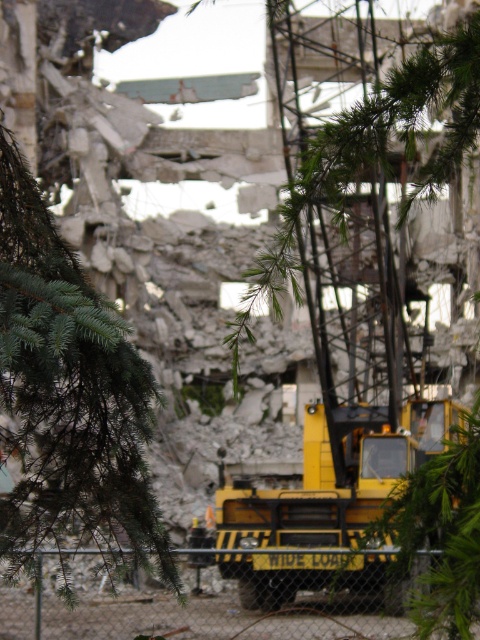
Question: Can you confirm if green needle-like leaves at left is wider than green needle-like branches at center?

Choices:
 (A) no
 (B) yes

Answer: (A)

Question: Which of the following is the closest to the observer?

Choices:
 (A) green needle-like branches at center
 (B) metal chain-link fence at center

Answer: (A)

Question: Which of these objects is positioned closest to the metal chain-link fence at center?

Choices:
 (A) green needle-like branches at center
 (B) green needle-like leaves at left

Answer: (B)

Question: Which of the following is the farthest from the observer?

Choices:
 (A) (371, 134)
 (B) (99, 490)
 (C) (168, 634)

Answer: (C)

Question: Where is green needle-like branches at center located in relation to metal chain-link fence at center in the image?

Choices:
 (A) right
 (B) left

Answer: (A)

Question: Does green needle-like branches at center appear on the right side of metal chain-link fence at center?

Choices:
 (A) no
 (B) yes

Answer: (B)